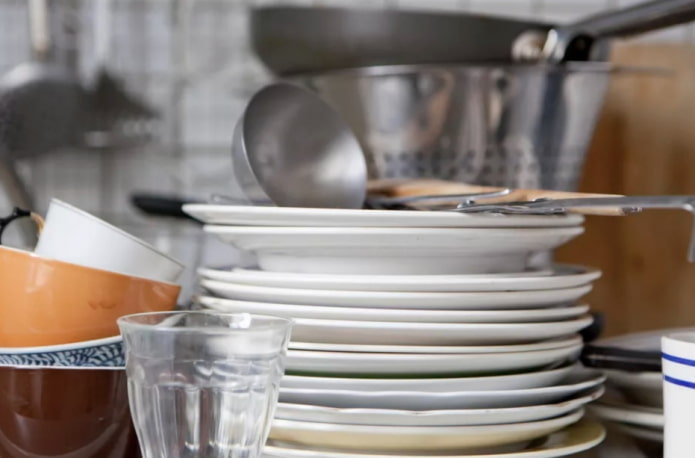
Image resolution: width=695 pixels, height=458 pixels. What are the coordinates of `random other dishes besides flat dinner plates` in the screenshot? It's located at (72, 407), (83, 353), (83, 298), (111, 243), (183, 353), (327, 162), (443, 184), (455, 117), (436, 36), (682, 374).